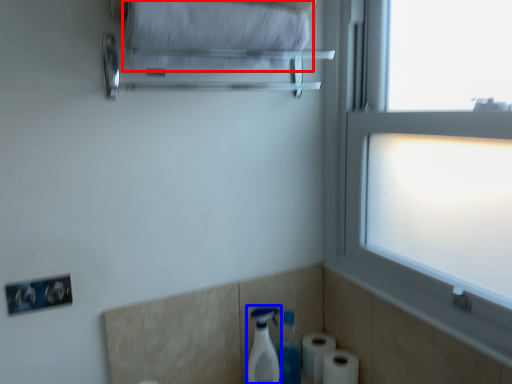
Question: Which of the following is the closest to the observer, bath towel (highlighted by a red box) or cleaning product (highlighted by a blue box)?

Choices:
 (A) bath towel
 (B) cleaning product

Answer: (A)